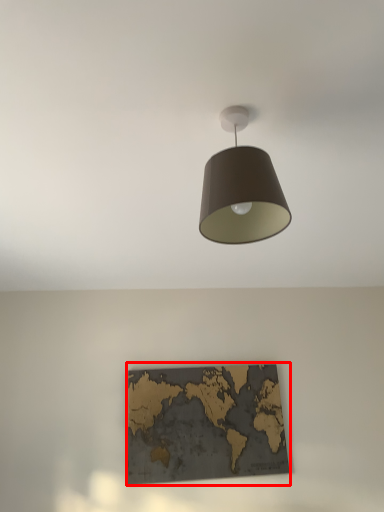
Question: From the image, what is the correct spatial relationship of picture frame (annotated by the red box) in relation to lamp?

Choices:
 (A) left
 (B) right

Answer: (A)